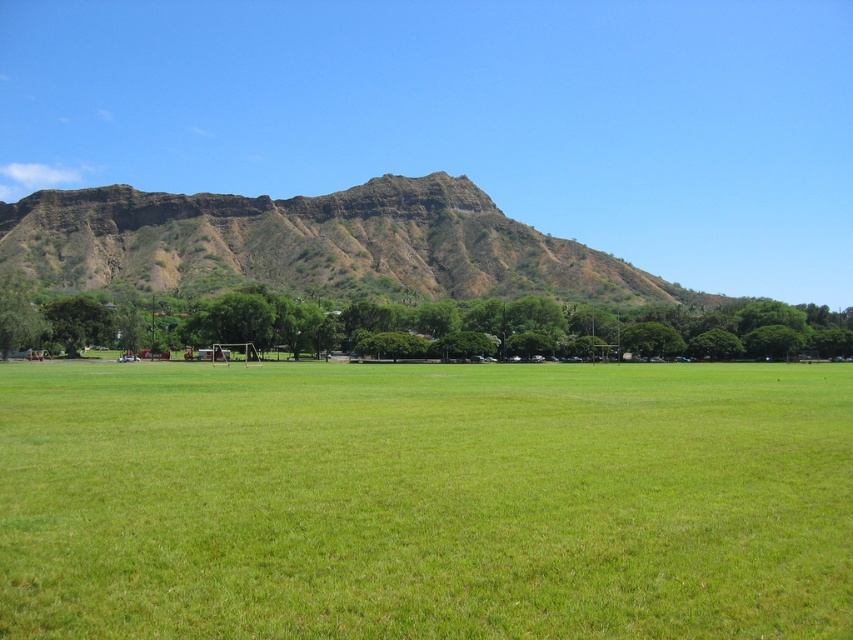
Question: Which object is positioned farthest from the brown rocky mountain at upper center?

Choices:
 (A) green leafy tree at center
 (B) green grass at center

Answer: (B)

Question: Among these points, which one is nearest to the camera?

Choices:
 (A) (94, 252)
 (B) (192, 316)
 (C) (560, 364)

Answer: (C)

Question: In this image, where is green grass at center located relative to brown rocky mountain at upper center?

Choices:
 (A) right
 (B) left

Answer: (A)

Question: Is brown rocky mountain at upper center bigger than green leafy tree at center?

Choices:
 (A) yes
 (B) no

Answer: (A)

Question: From the image, what is the correct spatial relationship of brown rocky mountain at upper center in relation to green leafy tree at center?

Choices:
 (A) below
 (B) above

Answer: (B)

Question: Which object appears closest to the camera in this image?

Choices:
 (A) green grass at center
 (B) brown rocky mountain at upper center

Answer: (A)